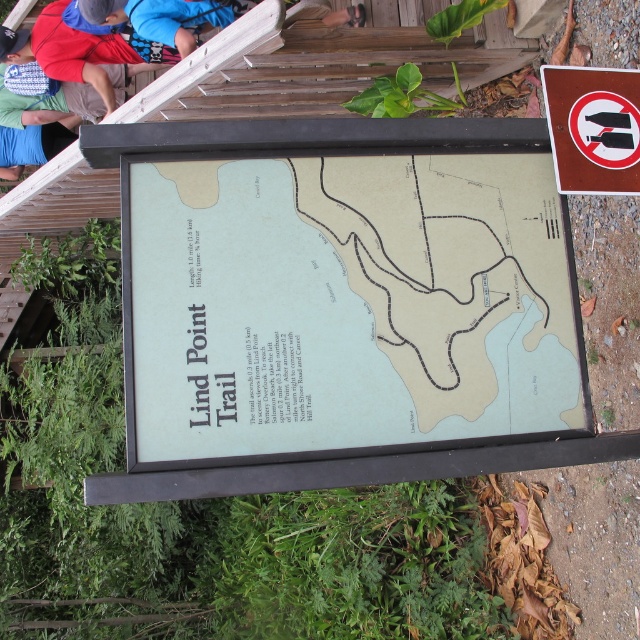
Image resolution: width=640 pixels, height=640 pixels. In order to click on white plastic sign at upper right in this screenshot , I will do `click(593, 129)`.

Can you confirm if white plastic sign at upper right is wider than blue fabric shirt at upper left?

No.

The height and width of the screenshot is (640, 640). What do you see at coordinates (593, 129) in the screenshot? I see `white plastic sign at upper right` at bounding box center [593, 129].

You are a GUI agent. You are given a task and a screenshot of the screen. Output one action in this format:
    pyautogui.click(x=<x>, y=<y>)
    Task: Click on the white plastic sign at upper right
    
    Given the screenshot: What is the action you would take?
    pyautogui.click(x=593, y=129)

Does green paper map at center have a lesser height compared to blue fabric shirt at upper left?

Yes, green paper map at center is shorter than blue fabric shirt at upper left.

Is green paper map at center to the left of blue fabric shirt at upper left from the viewer's perspective?

No, green paper map at center is not to the left of blue fabric shirt at upper left.

Who is more distant from viewer, (317, 305) or (65, 116)?

Point (65, 116)

This screenshot has height=640, width=640. What are the coordinates of `green paper map at center` in the screenshot? It's located at (346, 305).

Which is in front, point (448, 282) or point (547, 90)?

Point (448, 282)

Does green paper map at center appear under white plastic sign at upper right?

Yes.

At what (x,y) coordinates should I click in order to perform the action: click on green paper map at center. Please return your answer as a coordinate pair (x, y). Looking at the image, I should click on (346, 305).

The height and width of the screenshot is (640, 640). Identify the location of green paper map at center. (346, 305).